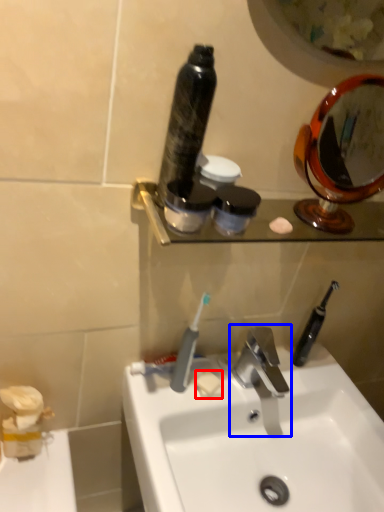
Question: Which object is further to the camera taking this photo, soap (highlighted by a red box) or tap (highlighted by a blue box)?

Choices:
 (A) soap
 (B) tap

Answer: (A)